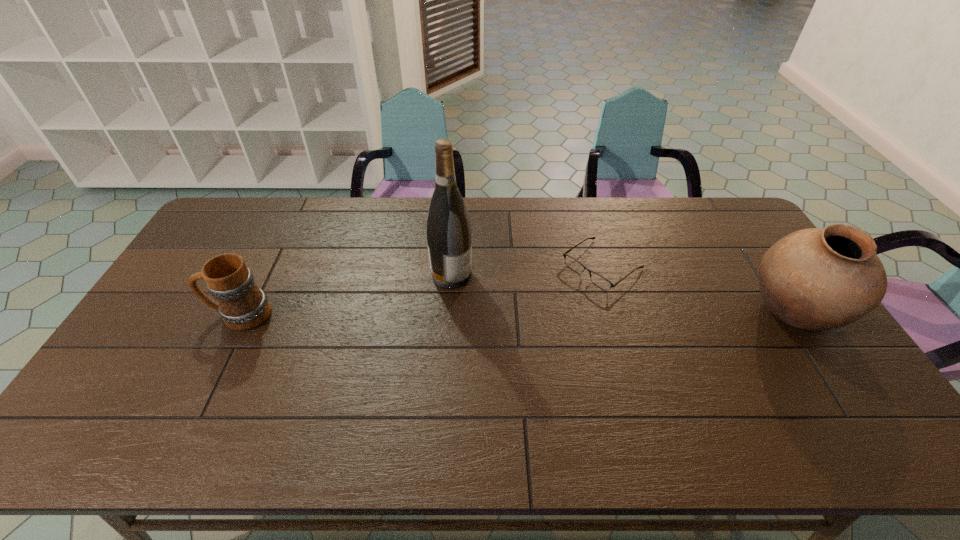
Locate an element on the screen. The width and height of the screenshot is (960, 540). the leftmost object is located at coordinates (x=243, y=306).

You are a GUI agent. You are given a task and a screenshot of the screen. Output one action in this format:
    pyautogui.click(x=<x>, y=<y>)
    Task: Click on the mug
    Image resolution: width=960 pixels, height=540 pixels.
    Given the screenshot: What is the action you would take?
    pyautogui.click(x=243, y=306)

The width and height of the screenshot is (960, 540). What are the coordinates of `pottery` in the screenshot? It's located at (816, 279).

This screenshot has height=540, width=960. I want to click on the rightmost object, so click(816, 279).

Identify the location of wine bottle. (448, 229).

The image size is (960, 540). Find the location of `the tallest object`. the tallest object is located at coordinates [448, 229].

This screenshot has height=540, width=960. In order to click on the second object from right to left in this screenshot , I will do `click(600, 281)`.

Locate an element on the screen. This screenshot has width=960, height=540. the shortest object is located at coordinates (600, 281).

Where is `free region located 0.150m on the side of the mug with the handle`? The image size is (960, 540). free region located 0.150m on the side of the mug with the handle is located at coordinates (157, 315).

You are a GUI agent. You are given a task and a screenshot of the screen. Output one action in this format:
    pyautogui.click(x=<x>, y=<y>)
    Task: Click on the vacant space located on the side of the mug with the handle
    
    Given the screenshot: What is the action you would take?
    pyautogui.click(x=167, y=315)